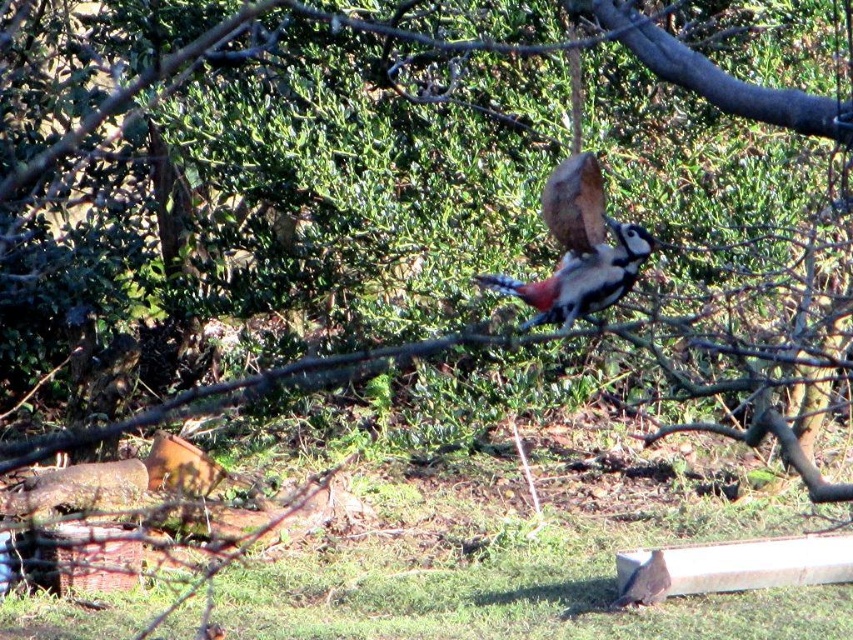
You are an ornithologist observing a woodpecker in flight. You notice a point marked at coordinates (582, 276) in the image. Based on the scene description, what does this point indicate?

The point at coordinates (582, 276) marks the location of the speckled brown woodpecker at center in the image.

You are an ornithologist studying bird flight patterns. You observe the speckled brown woodpecker at center in the image. Based on its position at coordinates, can you determine if it is closer to the top or bottom of the image?

The speckled brown woodpecker at center is located at coordinates point [582,276]. Since the y coordinate is 0.683, which is closer to 1.0, the top of the image, the bird is closer to the top.

You are an ornithologist observing two birds in the same scene. You notice a speckled brown woodpecker at center and a speckled brown bird at center. Which bird has a larger wingspan?

The speckled brown woodpecker at center has a larger wingspan than the speckled brown bird at center.